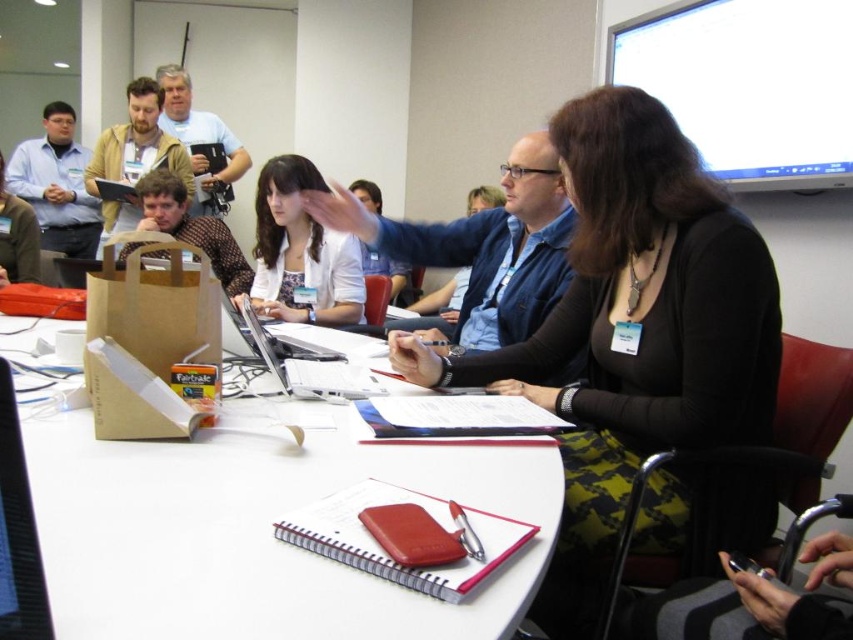
You are a guest at this meeting and need to place your name tag on the white paper table at center. However, you notice the matte white shirt at center is already occupying space. Can you place your name tag on the table without it being obscured by the shirt?

The white paper table at center is not as tall as matte white shirt at center, so placing the name tag on the table might result in the shirt obscuring it. You should adjust the position of the name tag to ensure it is visible above the shirt or move the shirt if possible.

You are organizing a meeting and need to place a large folder on the table. Considering the white paper table at center and the matte white shirt at center, which object can the folder be placed on without obstructing the shirt?

The folder can be placed on the white paper table at center because it is wider than the matte white shirt at center, so there will be enough space to avoid obstruction.

You are a photographer in the conference room. You need to take a photo of the matte white shirt at center and the matte brown paper bag at upper left. Which object should you focus on first if you want to capture both in a single shot without moving the camera?

The matte brown paper bag at upper left is taller than the matte white shirt at center, so you should focus on the matte brown paper bag at upper left first to ensure both objects are in frame.